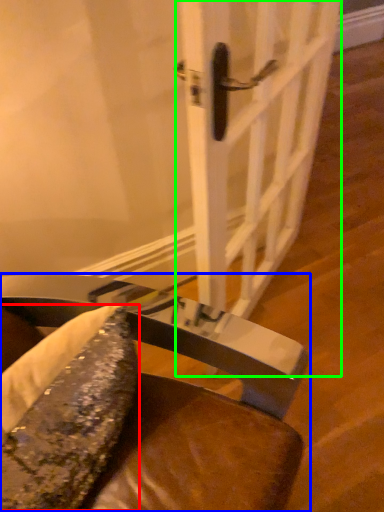
Question: Which object is positioned farthest from food (highlighted by a red box)? Select from chair (highlighted by a blue box) and door (highlighted by a green box).

Choices:
 (A) chair
 (B) door

Answer: (B)